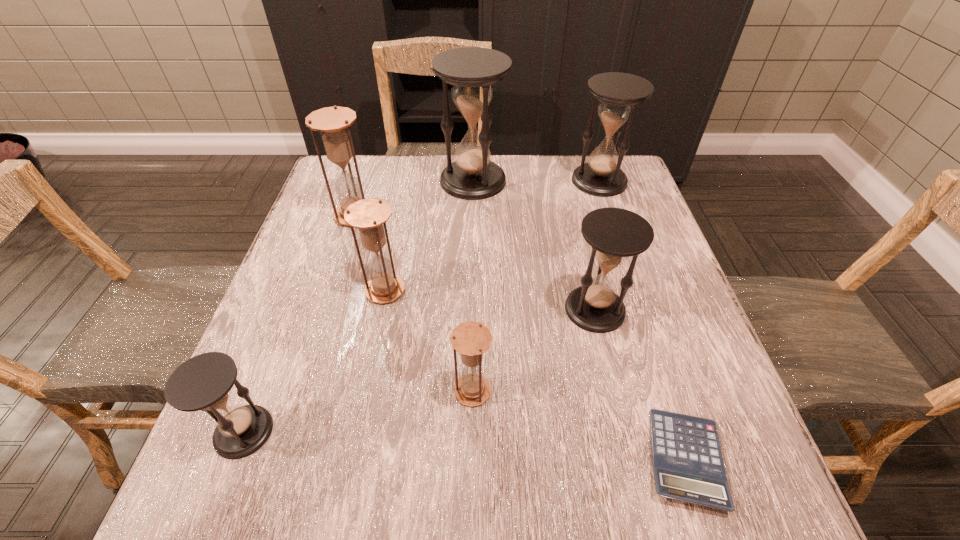
Locate an element on the screen. free space at the left edge is located at coordinates (325, 281).

The width and height of the screenshot is (960, 540). What are the coordinates of `free space at the right edge of the desktop` in the screenshot? It's located at (674, 392).

Identify the location of blank area at the far left corner. The height and width of the screenshot is (540, 960). (372, 189).

Find the location of a particular element. free space at the far right corner of the desktop is located at coordinates (588, 161).

You are a GUI agent. You are given a task and a screenshot of the screen. Output one action in this format:
    pyautogui.click(x=<x>, y=<y>)
    Task: Click on the empty space between the second nearest brown hourglass and the third smallest black hourglass
    This screenshot has width=960, height=540.
    Given the screenshot: What is the action you would take?
    pyautogui.click(x=492, y=235)

Identify the location of empty space between the tallest hourglass and the fifth hourglass from right to left. (429, 235).

At what (x,y) coordinates should I click in order to perform the action: click on free space that is in between the second smallest black hourglass and the leftmost black hourglass. Please return your answer as a coordinate pair (x, y). Image resolution: width=960 pixels, height=540 pixels. Looking at the image, I should click on (420, 370).

Where is `vacant region between the biggest brown hourglass and the second smallest black hourglass`? The width and height of the screenshot is (960, 540). vacant region between the biggest brown hourglass and the second smallest black hourglass is located at coordinates (475, 262).

This screenshot has height=540, width=960. In order to click on vacant region between the calculator and the third farthest black hourglass in this screenshot , I will do coord(640,384).

Find the location of a particular element. The height and width of the screenshot is (540, 960). vacant area that lies between the second smallest black hourglass and the smallest brown hourglass is located at coordinates (534, 350).